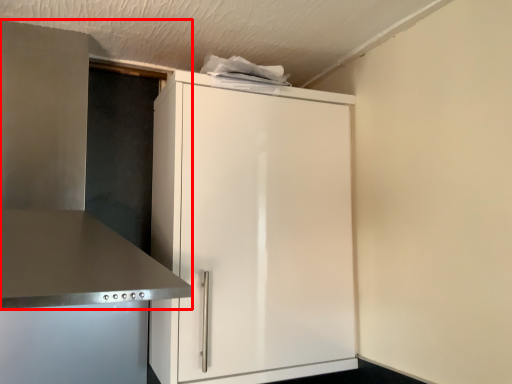
Question: From the image's perspective, where is vent (annotated by the red box) located in relation to cupboard in the image?

Choices:
 (A) below
 (B) above

Answer: (B)